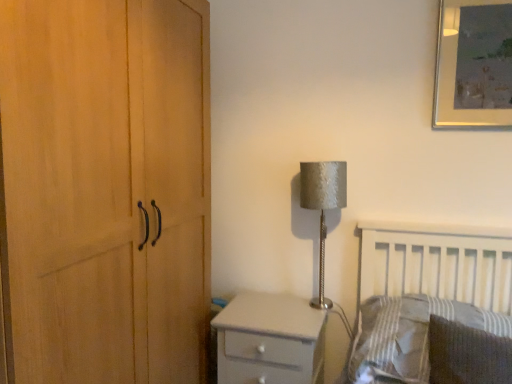
Question: Considering the relative positions of white glossy chest of drawers at lower center and dark gray textured pillow at lower right, the 2th pillow from the back, in the image provided, is white glossy chest of drawers at lower center in front of dark gray textured pillow at lower right, the 2th pillow from the back,?

Choices:
 (A) yes
 (B) no

Answer: (B)

Question: Is white glossy chest of drawers at lower center at the left side of dark gray textured pillow at lower right, the 1th pillow in the front-to-back sequence?

Choices:
 (A) yes
 (B) no

Answer: (A)

Question: Does white glossy chest of drawers at lower center have a lesser width compared to dark gray textured pillow at lower right, the 1th pillow in the front-to-back sequence?

Choices:
 (A) no
 (B) yes

Answer: (B)

Question: Does white glossy chest of drawers at lower center have a greater width compared to dark gray textured pillow at lower right, the 2th pillow from the back?

Choices:
 (A) no
 (B) yes

Answer: (A)

Question: From the image's perspective, is white glossy chest of drawers at lower center located beneath dark gray textured pillow at lower right, the 2th pillow from the back?

Choices:
 (A) no
 (B) yes

Answer: (B)

Question: From a real-world perspective, is white glossy chest of drawers at lower center above or below silver textured lampshade at upper right?

Choices:
 (A) above
 (B) below

Answer: (B)

Question: Is point (245, 345) positioned closer to the camera than point (337, 198)?

Choices:
 (A) farther
 (B) closer

Answer: (B)

Question: Is white glossy chest of drawers at lower center to the left or to the right of silver textured lampshade at upper right in the image?

Choices:
 (A) right
 (B) left

Answer: (B)

Question: In the image, is white glossy chest of drawers at lower center positioned in front of or behind silver textured lampshade at upper right?

Choices:
 (A) behind
 (B) front

Answer: (B)

Question: Is metallic silver picture frame at upper right wider or thinner than striped fabric pillow at lower right, the second pillow in the front-to-back sequence?

Choices:
 (A) thin
 (B) wide

Answer: (A)

Question: From a real-world perspective, relative to striped fabric pillow at lower right, the second pillow in the front-to-back sequence, is metallic silver picture frame at upper right vertically above or below?

Choices:
 (A) above
 (B) below

Answer: (A)

Question: Relative to striped fabric pillow at lower right, the first pillow viewed from the back, is metallic silver picture frame at upper right in front or behind?

Choices:
 (A) behind
 (B) front

Answer: (A)

Question: Would you say metallic silver picture frame at upper right is inside or outside striped fabric pillow at lower right, the first pillow viewed from the back?

Choices:
 (A) outside
 (B) inside

Answer: (A)

Question: Considering the positions of point (269, 334) and point (470, 66), is point (269, 334) closer or farther from the camera than point (470, 66)?

Choices:
 (A) closer
 (B) farther

Answer: (A)

Question: Is white glossy chest of drawers at lower center taller or shorter than metallic silver picture frame at upper right?

Choices:
 (A) short
 (B) tall

Answer: (A)